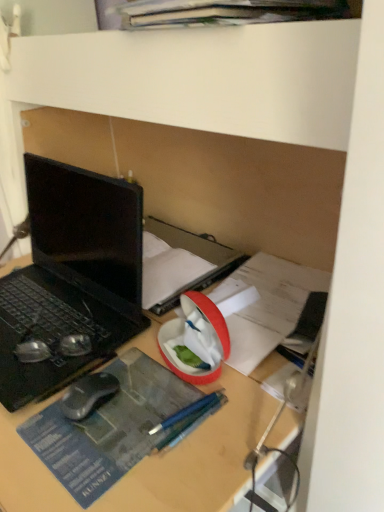
Question: Can we say matte black book at center lies outside black matte laptop at left?

Choices:
 (A) yes
 (B) no

Answer: (A)

Question: Is matte black book at center aimed at black matte laptop at left?

Choices:
 (A) yes
 (B) no

Answer: (A)

Question: From a real-world perspective, is matte black book at center positioned under black matte laptop at left based on gravity?

Choices:
 (A) no
 (B) yes

Answer: (B)

Question: Does matte black book at center touch black matte laptop at left?

Choices:
 (A) yes
 (B) no

Answer: (B)

Question: Can you confirm if matte black book at center is wider than black matte laptop at left?

Choices:
 (A) yes
 (B) no

Answer: (B)

Question: Do you think black rubberized mouse at lower left is within matte black book at center, or outside of it?

Choices:
 (A) outside
 (B) inside

Answer: (A)

Question: Is black rubberized mouse at lower left wider or thinner than matte black book at center?

Choices:
 (A) wide
 (B) thin

Answer: (B)

Question: Looking at the image, does black rubberized mouse at lower left seem bigger or smaller compared to matte black book at center?

Choices:
 (A) small
 (B) big

Answer: (A)

Question: In terms of height, does black rubberized mouse at lower left look taller or shorter compared to matte black book at center?

Choices:
 (A) short
 (B) tall

Answer: (A)

Question: Is matte black book at center wider or thinner than black matte laptop at left?

Choices:
 (A) wide
 (B) thin

Answer: (B)

Question: Visually, is matte black book at center positioned to the left or to the right of black matte laptop at left?

Choices:
 (A) right
 (B) left

Answer: (A)

Question: In terms of size, does matte black book at center appear bigger or smaller than black matte laptop at left?

Choices:
 (A) big
 (B) small

Answer: (B)

Question: Considering the positions of point (193, 245) and point (33, 324), is point (193, 245) closer or farther from the camera than point (33, 324)?

Choices:
 (A) closer
 (B) farther

Answer: (B)

Question: Is black rubberized mouse at lower left in front of or behind metallic blue pencil at center in the image?

Choices:
 (A) front
 (B) behind

Answer: (B)

Question: Does point (104, 371) appear closer or farther from the camera than point (168, 440)?

Choices:
 (A) closer
 (B) farther

Answer: (B)